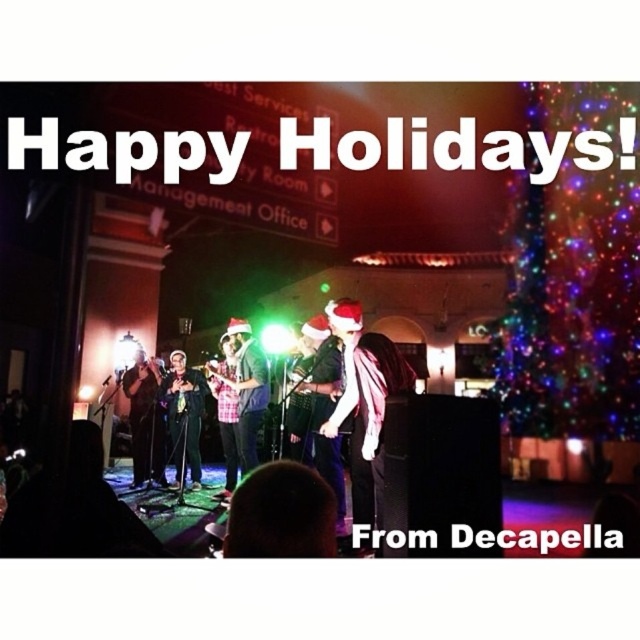
Question: Can you confirm if matte black shirt at center is wider than shiny black suit at center?

Choices:
 (A) no
 (B) yes

Answer: (B)

Question: Which of the following is the farthest from the observer?

Choices:
 (A) (321, 333)
 (B) (248, 340)
 (C) (148, 362)
 (D) (371, 339)

Answer: (C)

Question: In this image, where is plaid fabric shirt at center located relative to shiny black microphone at center?

Choices:
 (A) above
 (B) below

Answer: (A)

Question: Does matte black shirt at center have a lesser width compared to matte black microphone at center?

Choices:
 (A) no
 (B) yes

Answer: (A)

Question: Which point is farther to the camera?

Choices:
 (A) (150, 401)
 (B) (355, 419)

Answer: (A)

Question: Which point appears farthest from the camera in this image?

Choices:
 (A) (186, 442)
 (B) (131, 429)

Answer: (B)